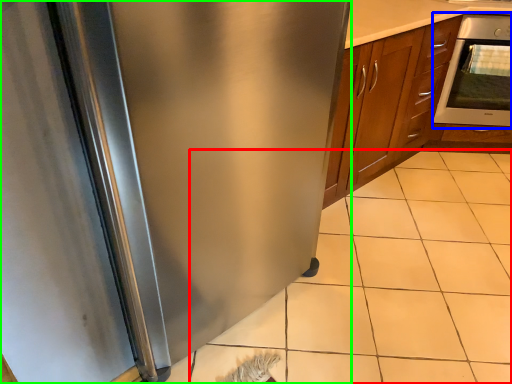
Question: Based on their relative distances, which object is farther from tile (highlighted by a red box)? Choose from oven (highlighted by a blue box) and refrigerator (highlighted by a green box).

Choices:
 (A) oven
 (B) refrigerator

Answer: (A)